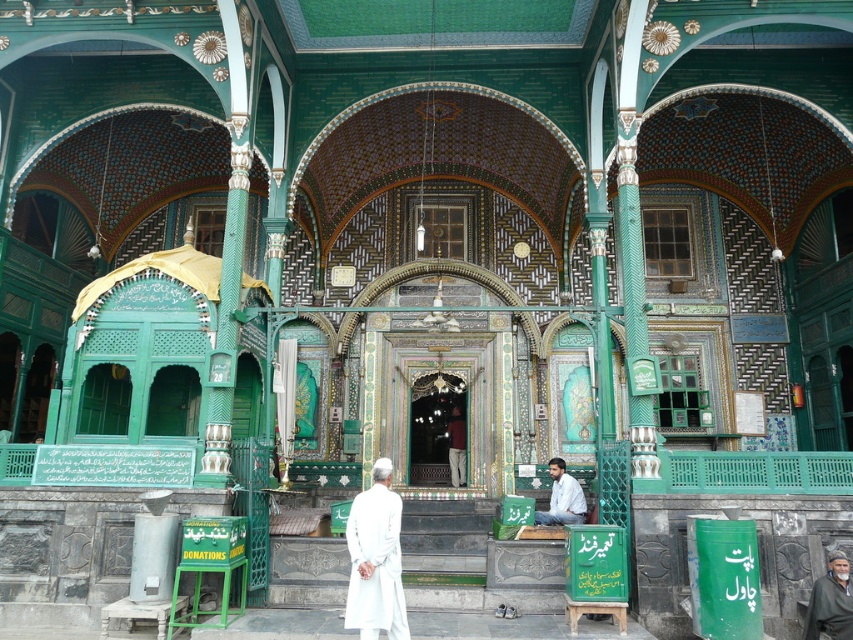
You are standing in the courtyard of the mosque and want to take a photo of both the ornate archway and the intricate ceiling design. You notice two points marked in the scene. Which point is closer to your camera when capturing both the point at (363, 502) and the point at (821, 609)?

Point (821, 609) is closer to the camera than point (363, 502) because the description states that point (363, 502) is further away.

You are standing in the mosque courtyard and see the white cotton robe at center. If you walk straight ahead, will you step on the robe?

The white cotton robe at center is located at point (375,564), so if you walk straight ahead, you will step on the robe.